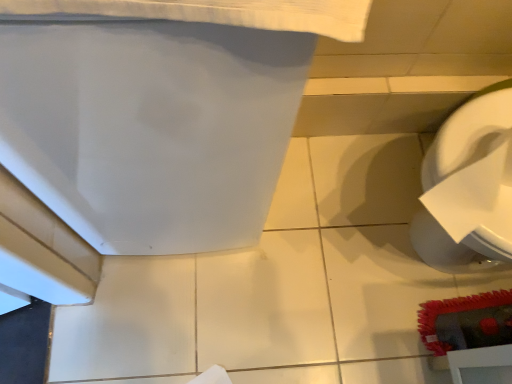
What do you see at coordinates (469, 188) in the screenshot?
I see `white glossy toilet at right` at bounding box center [469, 188].

The height and width of the screenshot is (384, 512). I want to click on white glossy toilet at right, so click(469, 188).

Where is `white glossy toilet at right`? white glossy toilet at right is located at coordinates (469, 188).